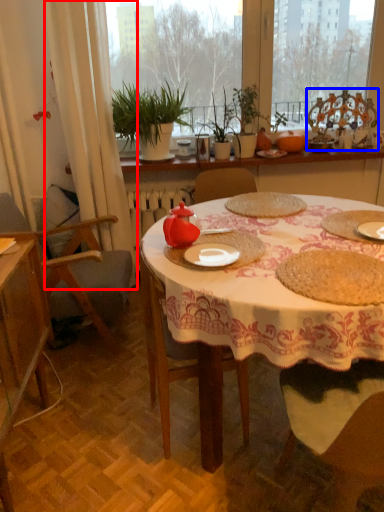
Question: Which of the following is the farthest to the observer, curtain (highlighted by a red box) or chair (highlighted by a blue box)?

Choices:
 (A) curtain
 (B) chair

Answer: (B)